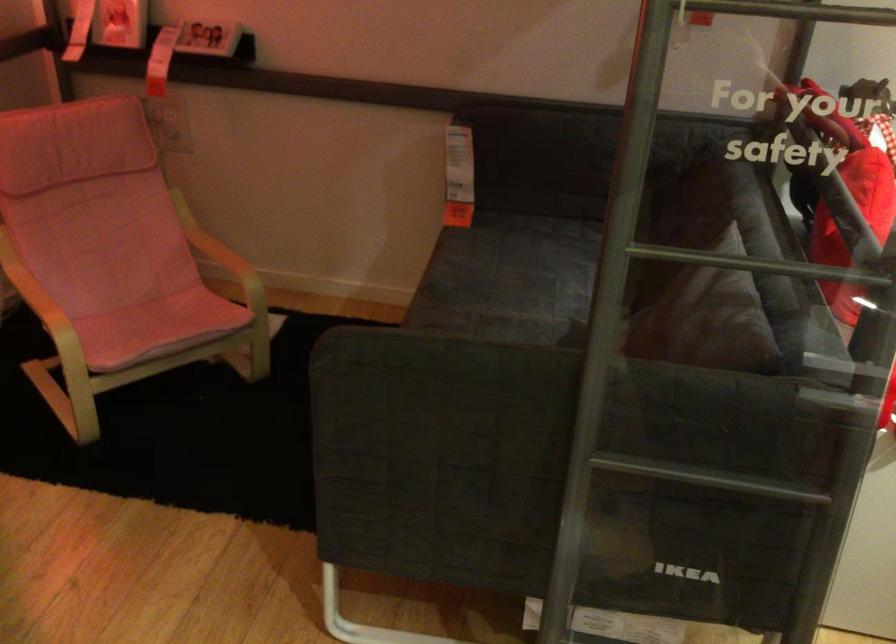
The width and height of the screenshot is (896, 644). I want to click on pink chair sitting surface, so click(x=126, y=307).